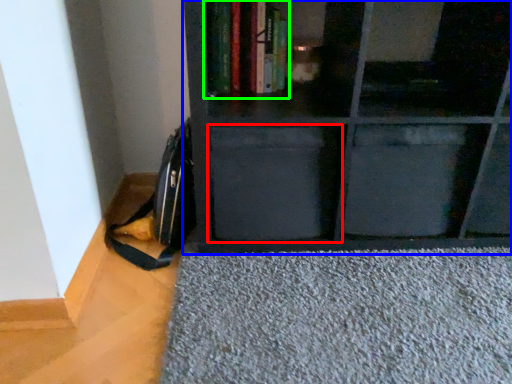
Question: Which object is the farthest from drawer (highlighted by a red box)? Choose among these: shelf (highlighted by a blue box) or book (highlighted by a green box).

Choices:
 (A) shelf
 (B) book

Answer: (B)